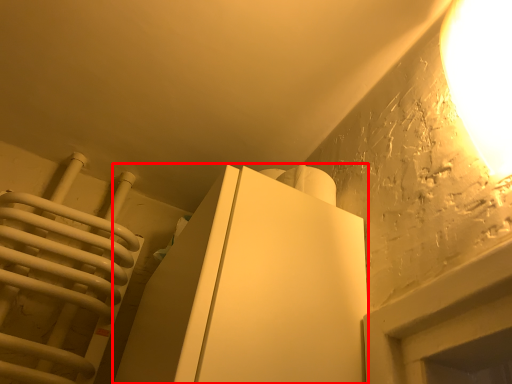
Question: From the image's perspective, what is the correct spatial positioning of furniture (annotated by the red box) in reference to lamp?

Choices:
 (A) above
 (B) below

Answer: (B)